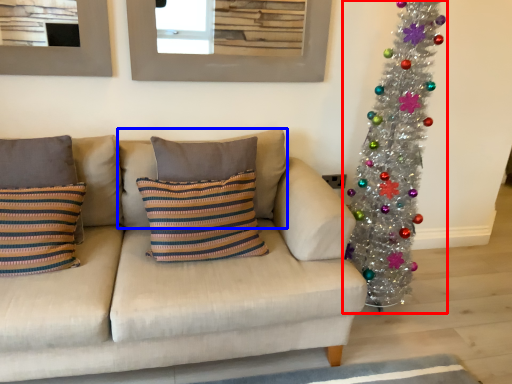
Question: Which object is further to the camera taking this photo, christmas tree (highlighted by a red box) or pillow (highlighted by a blue box)?

Choices:
 (A) christmas tree
 (B) pillow

Answer: (B)